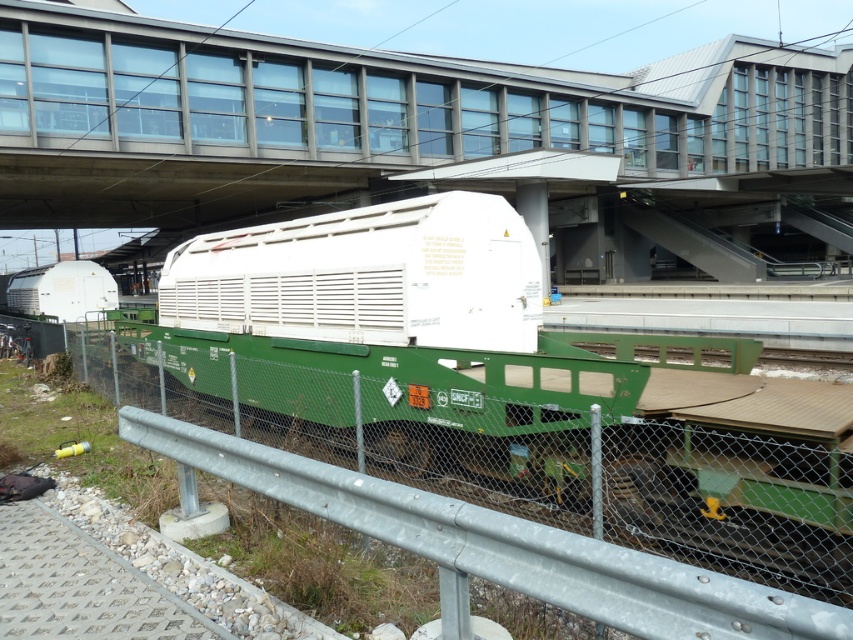
Question: Is white matte container at center wider than metal at center?

Choices:
 (A) yes
 (B) no

Answer: (A)

Question: Does white matte container at center appear under metal at center?

Choices:
 (A) no
 (B) yes

Answer: (A)

Question: Which point is closer to the camera?

Choices:
 (A) click(x=804, y=563)
 (B) click(x=190, y=230)

Answer: (A)

Question: Which point appears closest to the camera in this image?

Choices:
 (A) (418, 180)
 (B) (712, 524)

Answer: (B)

Question: Can you confirm if white matte container at center is positioned below metal at center?

Choices:
 (A) no
 (B) yes

Answer: (A)